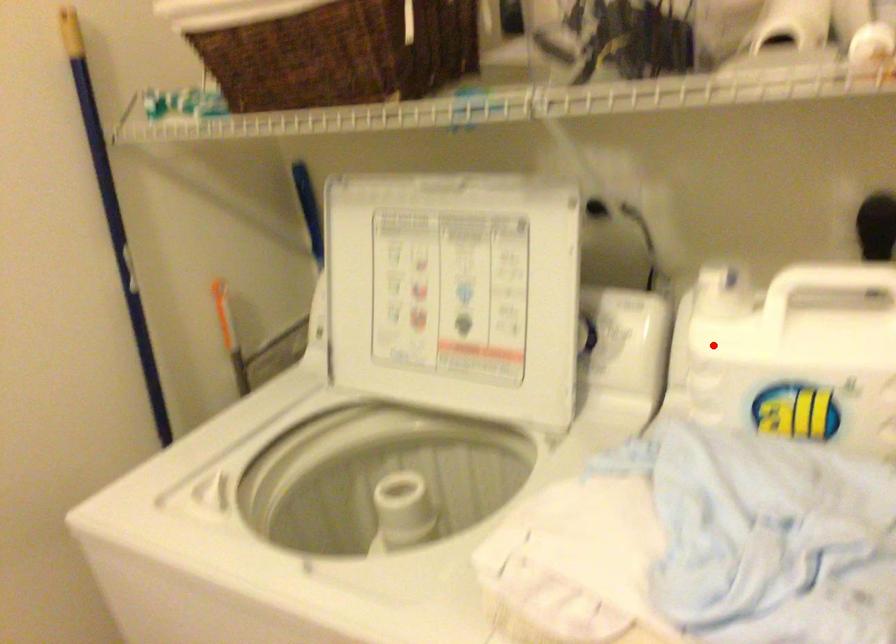
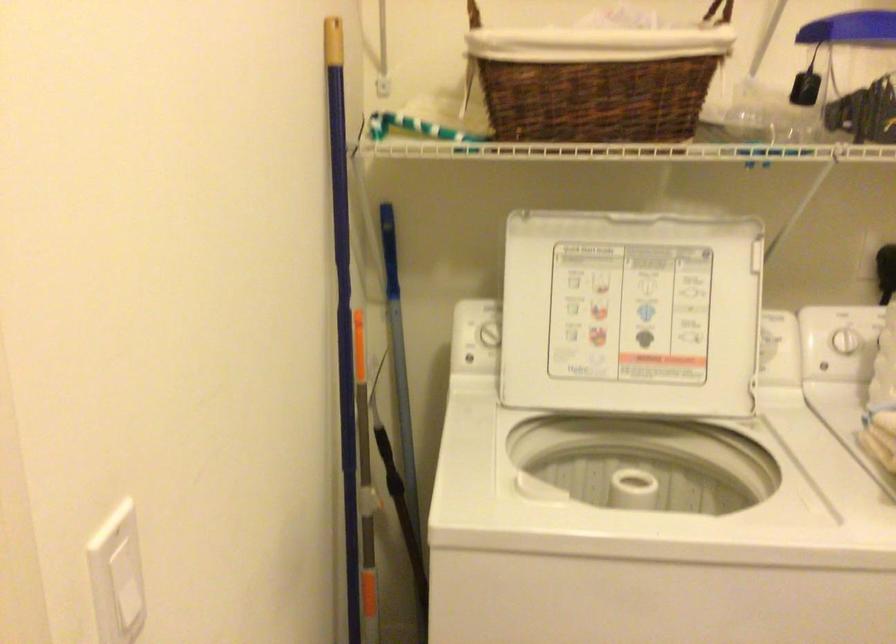
Question: I am providing you with two images of the same scene from different viewpoints. Given a red point in image1, look at the same physical point in image2. Is it:

Choices:
 (A) Closer to the viewpoint
 (B) Farther from the viewpoint

Answer: (B)